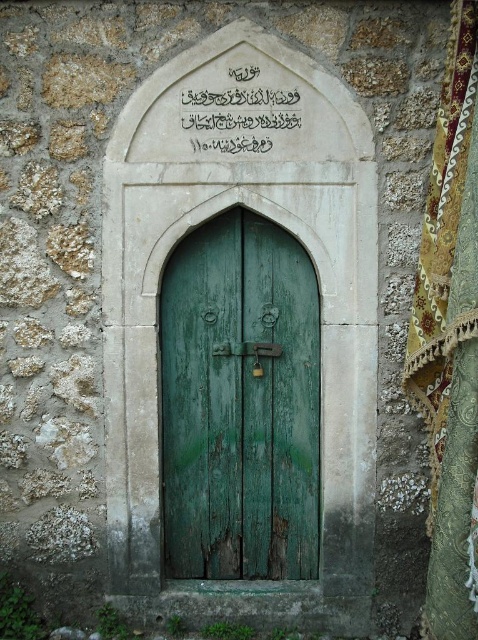
You are standing in front of the wooden door and want to reach a point that is 3.64 meters away from your current position. Can you determine if the point at coordinates (x=167, y=307) is within reach?

The point at coordinates (x=167, y=307) is 3.64 meters from the camera, so if you are standing at the camera position, you can reach it by extending your arm or taking a small step forward.